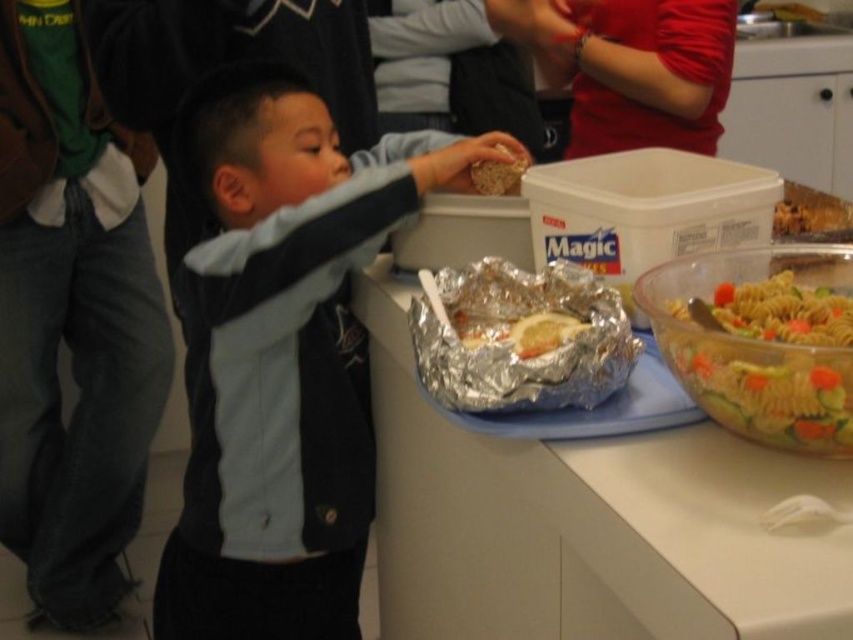
You are a guest at the event and want to place a small plate between the green brushed fabric pants at lower left and the multicolored pasta salad at right. Can you fit it there?

The green brushed fabric pants at lower left has a greater height compared to the multicolored pasta salad at right, so there should be enough space between them to place a small plate.

You are a guest at this event and want to grab a snack. You see the green brushed fabric pants at lower left and the multicolored pasta salad at right. Which one is closer to the floor?

The green brushed fabric pants at lower left is below the multicolored pasta salad at right, so it is closer to the floor.